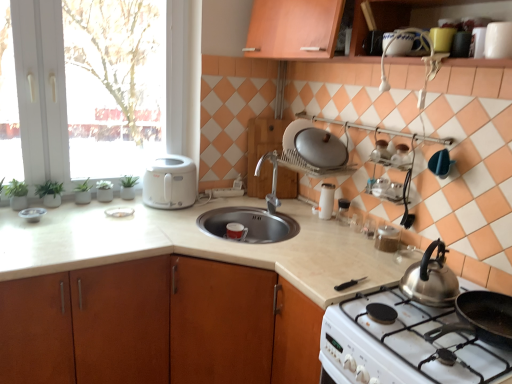
Find the location of a particular element. vacant area that lies between white plastic toaster at left, which is the third kitchen appliance in right-to-left order, and white glossy plate at left, the 3th appliance viewed from the top is located at coordinates (132, 204).